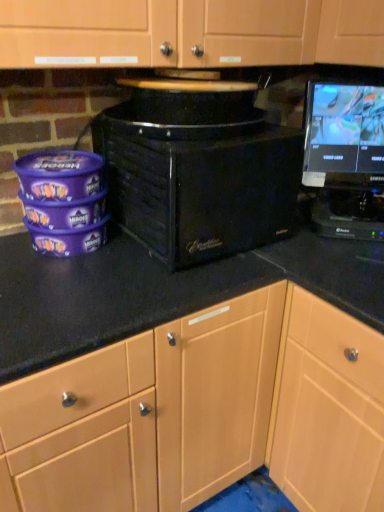
Where is `black matte microwave at center`? The width and height of the screenshot is (384, 512). black matte microwave at center is located at coordinates (198, 170).

Where is `light wood cabinet at lower right`? light wood cabinet at lower right is located at coordinates (328, 409).

The image size is (384, 512). What are the coordinates of `black matte microwave at center` in the screenshot? It's located at tap(198, 170).

Is black glossy monitor at upper right positioned beyond the bounds of light wood cabinet at lower right?

black glossy monitor at upper right is positioned outside light wood cabinet at lower right.

Considering the sizes of black glossy monitor at upper right and light wood cabinet at lower right in the image, is black glossy monitor at upper right taller or shorter than light wood cabinet at lower right?

Clearly, black glossy monitor at upper right is shorter compared to light wood cabinet at lower right.

Is black glossy monitor at upper right bigger than light wood cabinet at lower right?

No.

Is black glossy monitor at upper right placed right next to light wood cabinet at lower right?

No, black glossy monitor at upper right is not next to light wood cabinet at lower right.

Is light wood cabinet at lower right not near black glossy monitor at upper right?

They are positioned close to each other.

From the image's perspective, which is above, light wood cabinet at lower right or black glossy monitor at upper right?

black glossy monitor at upper right is shown above in the image.

Which object is positioned more to the right, light wood cabinet at lower right or black glossy monitor at upper right?

light wood cabinet at lower right.

Where is `computer monitor above the black matte microwave at center (from the image's perspective)`? The image size is (384, 512). computer monitor above the black matte microwave at center (from the image's perspective) is located at coordinates tap(343, 132).

Would you say black matte microwave at center is part of black glossy monitor at upper right's contents?

No, black matte microwave at center is located outside of black glossy monitor at upper right.

Is black glossy monitor at upper right oriented towards black matte microwave at center?

No, black glossy monitor at upper right is not turned towards black matte microwave at center.

From the image's perspective, is black glossy monitor at upper right below black matte microwave at center?

Incorrect, from the image's perspective, black glossy monitor at upper right is higher than black matte microwave at center.

Is black matte microwave at center turned away from black glossy monitor at upper right?

No, black matte microwave at center's orientation is not away from black glossy monitor at upper right.

Considering the sizes of black matte microwave at center and black glossy monitor at upper right in the image, is black matte microwave at center wider or thinner than black glossy monitor at upper right?

In the image, black matte microwave at center appears to be wider than black glossy monitor at upper right.

Consider the image. Can you confirm if black matte microwave at center is shorter than black glossy monitor at upper right?

Correct, black matte microwave at center is not as tall as black glossy monitor at upper right.

Does black matte microwave at center lie behind black glossy monitor at upper right?

No, black matte microwave at center is closer to the camera.

Is light wood cabinet at lower right bigger or smaller than black matte microwave at center?

light wood cabinet at lower right is bigger than black matte microwave at center.

At what (x,y) coordinates should I click in order to perform the action: click on cabinetry lying below the black matte microwave at center (from the image's perspective). Please return your answer as a coordinate pair (x, y). Image resolution: width=384 pixels, height=512 pixels. Looking at the image, I should click on (328, 409).

Is the depth of light wood cabinet at lower right less than that of black matte microwave at center?

Yes.

Can you see light wood cabinet at lower right touching black matte microwave at center?

light wood cabinet at lower right is not next to black matte microwave at center, and they're not touching.

Is black matte microwave at center shorter than light wood cabinet at lower right?

Yes.

At what (x,y) coordinates should I click in order to perform the action: click on cabinetry below the black matte microwave at center (from the image's perspective). Please return your answer as a coordinate pair (x, y). This screenshot has height=512, width=384. Looking at the image, I should click on (328, 409).

Is point (247, 104) less distant than point (302, 476)?

Yes.

Looking at this image, is black matte microwave at center oriented away from light wood cabinet at lower right?

black matte microwave at center is not turned away from light wood cabinet at lower right.

The width and height of the screenshot is (384, 512). I want to click on cabinetry in front of the black glossy monitor at upper right, so click(328, 409).

Locate an element on the screen. This screenshot has height=512, width=384. computer monitor above the light wood cabinet at lower right (from the image's perspective) is located at coordinates (343, 132).

Based on their spatial positions, is black matte microwave at center or light wood cabinet at lower right closer to black glossy monitor at upper right?

Based on the image, black matte microwave at center appears to be nearer to black glossy monitor at upper right.

When comparing their distances from light wood cabinet at lower right, does black matte microwave at center or black glossy monitor at upper right seem closer?

The object closer to light wood cabinet at lower right is black matte microwave at center.

Considering their positions, is black glossy monitor at upper right positioned closer to light wood cabinet at lower right than black matte microwave at center?

black matte microwave at center is positioned closer to the anchor light wood cabinet at lower right.

Considering their positions, is black glossy monitor at upper right positioned closer to black matte microwave at center than light wood cabinet at lower right?

Among the two, black glossy monitor at upper right is located nearer to black matte microwave at center.

From the image, which object appears to be farther from black matte microwave at center, light wood cabinet at lower right or black glossy monitor at upper right?

light wood cabinet at lower right.

Considering their positions, is light wood cabinet at lower right positioned further to black glossy monitor at upper right than black matte microwave at center?

light wood cabinet at lower right.

Locate an element on the screen. Image resolution: width=384 pixels, height=512 pixels. home appliance between black glossy monitor at upper right and light wood cabinet at lower right from top to bottom is located at coordinates (198, 170).